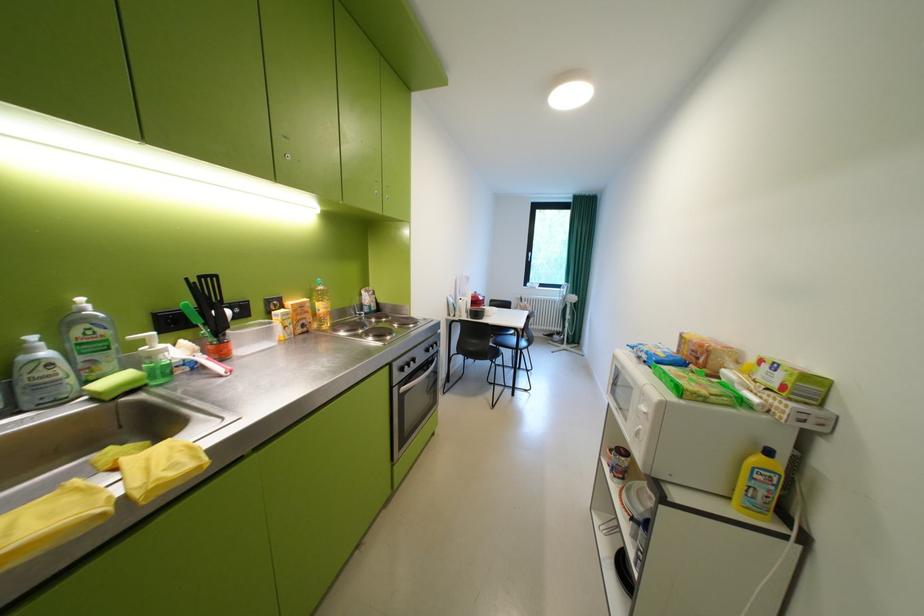
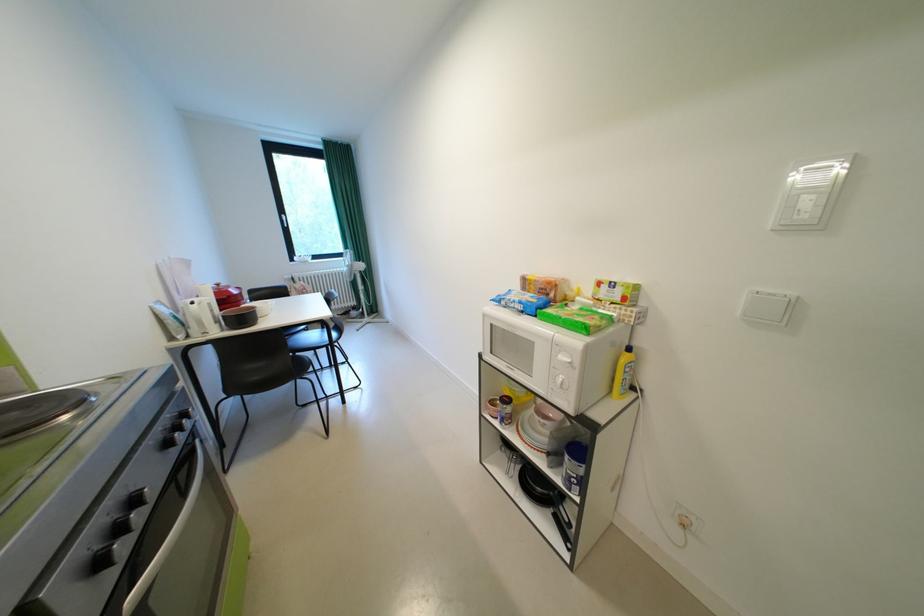
Locate, in the second image, the point that corresponds to pixel 419 365 in the first image.

(129, 531)